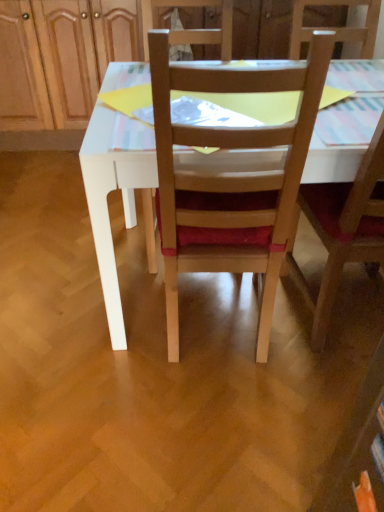
The height and width of the screenshot is (512, 384). I want to click on wooden chair at center, acting as the first chair starting from the left, so click(x=231, y=177).

The image size is (384, 512). Describe the element at coordinates (231, 177) in the screenshot. I see `wooden chair at center, acting as the first chair starting from the left` at that location.

Locate an element on the screen. This screenshot has width=384, height=512. wooden chair at center, positioned as the 1th chair in right-to-left order is located at coordinates (343, 229).

Where is `wooden dresser at upper center`? This screenshot has width=384, height=512. wooden dresser at upper center is located at coordinates (60, 58).

The height and width of the screenshot is (512, 384). In order to click on wooden chair at center, the 2th chair viewed from the right in this screenshot , I will do `click(231, 177)`.

Is wooden chair at center, the 2th chair from the left, positioned in front of wooden dresser at upper center?

Yes, it is.

Based on the photo, is wooden chair at center, the 2th chair from the left, with wooden dresser at upper center?

No.

Based on the photo, from the image's perspective, is wooden chair at center, the 2th chair from the left, positioned above or below wooden dresser at upper center?

From the image's perspective, wooden chair at center, the 2th chair from the left, appears below wooden dresser at upper center.

How different are the orientations of wooden chair at center, positioned as the 1th chair in right-to-left order, and wooden dresser at upper center in degrees?

The facing directions of wooden chair at center, positioned as the 1th chair in right-to-left order, and wooden dresser at upper center are 180 degrees apart.

From the image's perspective, which is above, wooden dresser at upper center or wooden chair at center, acting as the first chair starting from the left?

wooden dresser at upper center.

Is point (86, 122) closer to viewer compared to point (277, 203)?

That is False.

Is wooden dresser at upper center oriented towards wooden chair at center, acting as the first chair starting from the left?

Yes, wooden dresser at upper center is oriented towards wooden chair at center, acting as the first chair starting from the left.

Considering the relative positions of wooden dresser at upper center and wooden chair at center, the 2th chair from the left, in the image provided, is wooden dresser at upper center to the right of wooden chair at center, the 2th chair from the left, from the viewer's perspective?

Incorrect, wooden dresser at upper center is not on the right side of wooden chair at center, the 2th chair from the left.

Is wooden dresser at upper center positioned with its back to wooden chair at center, positioned as the 1th chair in right-to-left order?

That's not correct — wooden dresser at upper center is not looking away from wooden chair at center, positioned as the 1th chair in right-to-left order.

Are wooden dresser at upper center and wooden chair at center, positioned as the 1th chair in right-to-left order, far apart?

Yes, wooden dresser at upper center and wooden chair at center, positioned as the 1th chair in right-to-left order, are located far from each other.

Which is in front, point (77, 51) or point (383, 144)?

Positioned in front is point (383, 144).

From the image's perspective, between wooden chair at center, the 2th chair from the left, and wooden chair at center, acting as the first chair starting from the left, which one is located above?

wooden chair at center, the 2th chair from the left, is shown above in the image.

Between wooden chair at center, the 2th chair from the left, and wooden chair at center, the 2th chair viewed from the right, which one has smaller size?

wooden chair at center, the 2th chair from the left.

Would you say wooden chair at center, the 2th chair from the left, is a long distance from wooden chair at center, the 2th chair viewed from the right?

No, there isn't a large distance between wooden chair at center, the 2th chair from the left, and wooden chair at center, the 2th chair viewed from the right.

Looking at their sizes, would you say wooden chair at center, positioned as the 1th chair in right-to-left order, is wider or thinner than wooden chair at center, acting as the first chair starting from the left?

Considering their sizes, wooden chair at center, positioned as the 1th chair in right-to-left order, looks slimmer than wooden chair at center, acting as the first chair starting from the left.

Can you confirm if wooden chair at center, acting as the first chair starting from the left, is smaller than wooden chair at center, positioned as the 1th chair in right-to-left order?

No.

From a real-world perspective, is wooden chair at center, acting as the first chair starting from the left, positioned above or below wooden chair at center, the 2th chair from the left?

wooden chair at center, acting as the first chair starting from the left, is situated lower than wooden chair at center, the 2th chair from the left, in the real world.

Is wooden chair at center, acting as the first chair starting from the left, surrounding wooden chair at center, the 2th chair from the left?

Definitely not — wooden chair at center, the 2th chair from the left, is not inside wooden chair at center, acting as the first chair starting from the left.

Considering the relative positions of wooden chair at center, the 2th chair viewed from the right, and wooden chair at center, the 2th chair from the left, in the image provided, is wooden chair at center, the 2th chair viewed from the right, behind wooden chair at center, the 2th chair from the left,?

No, the depth of wooden chair at center, the 2th chair viewed from the right, is less than that of wooden chair at center, the 2th chair from the left.

Which is more to the right, wooden chair at center, acting as the first chair starting from the left, or wooden dresser at upper center?

wooden chair at center, acting as the first chair starting from the left.

Is wooden chair at center, acting as the first chair starting from the left, outside of wooden dresser at upper center?

wooden chair at center, acting as the first chair starting from the left, lies outside wooden dresser at upper center's area.

From a real-world perspective, is wooden chair at center, acting as the first chair starting from the left, positioned above or below wooden dresser at upper center?

wooden chair at center, acting as the first chair starting from the left, is situated higher than wooden dresser at upper center in the real world.

Does wooden chair at center, the 2th chair viewed from the right, have a smaller size compared to wooden dresser at upper center?

Correct, wooden chair at center, the 2th chair viewed from the right, occupies less space than wooden dresser at upper center.

There is a wooden dresser at upper center. Where is `the 1st chair below it (from the image's perspective)`? the 1st chair below it (from the image's perspective) is located at coordinates (343, 229).

Locate an element on the screen. The image size is (384, 512). dresser lying on the left of wooden chair at center, acting as the first chair starting from the left is located at coordinates (60, 58).

Based on the photo, estimate the real-world distances between objects in this image. Which object is further from wooden dresser at upper center, wooden chair at center, positioned as the 1th chair in right-to-left order, or wooden chair at center, acting as the first chair starting from the left?

Based on the image, wooden chair at center, positioned as the 1th chair in right-to-left order, appears to be further to wooden dresser at upper center.

Based on their spatial positions, is wooden chair at center, the 2th chair viewed from the right, or wooden dresser at upper center closer to wooden chair at center, positioned as the 1th chair in right-to-left order?

wooden chair at center, the 2th chair viewed from the right, lies closer to wooden chair at center, positioned as the 1th chair in right-to-left order, than the other object.

From the image, which object appears to be nearer to wooden dresser at upper center, wooden chair at center, acting as the first chair starting from the left, or wooden chair at center, the 2th chair from the left?

wooden chair at center, acting as the first chair starting from the left, lies closer to wooden dresser at upper center than the other object.

When comparing their distances from wooden chair at center, the 2th chair from the left, does wooden dresser at upper center or wooden chair at center, the 2th chair viewed from the right, seem further?

wooden dresser at upper center lies further to wooden chair at center, the 2th chair from the left, than the other object.

Looking at the image, which one is located closer to wooden chair at center, acting as the first chair starting from the left, wooden dresser at upper center or wooden chair at center, the 2th chair from the left?

Among the two, wooden chair at center, the 2th chair from the left, is located nearer to wooden chair at center, acting as the first chair starting from the left.

From the picture: Which object lies further to the anchor point wooden chair at center, acting as the first chair starting from the left, wooden chair at center, the 2th chair from the left, or wooden dresser at upper center?

wooden dresser at upper center lies further to wooden chair at center, acting as the first chair starting from the left, than the other object.

Find the location of a particular element. This screenshot has width=384, height=512. chair between wooden chair at center, acting as the first chair starting from the left, and wooden dresser at upper center in the front-back direction is located at coordinates (343, 229).